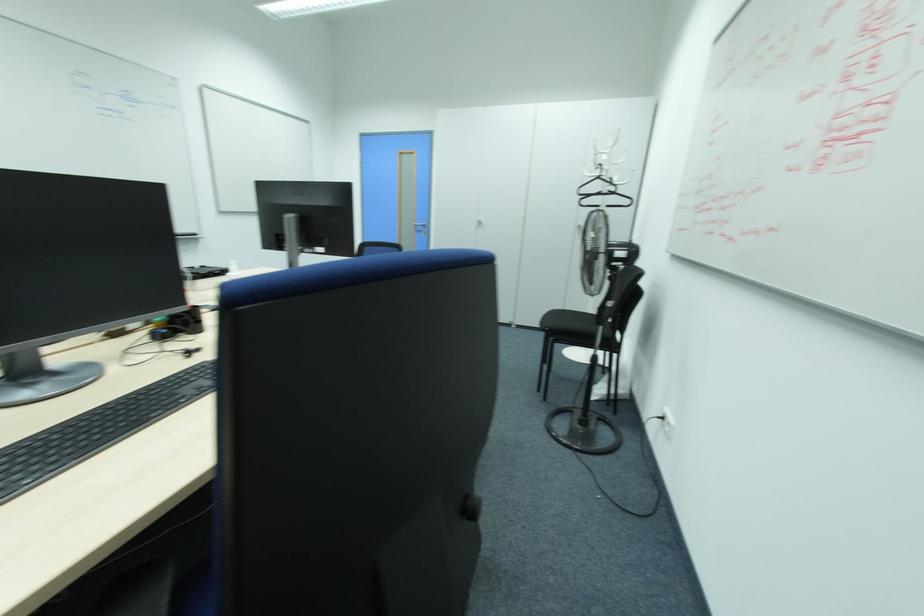
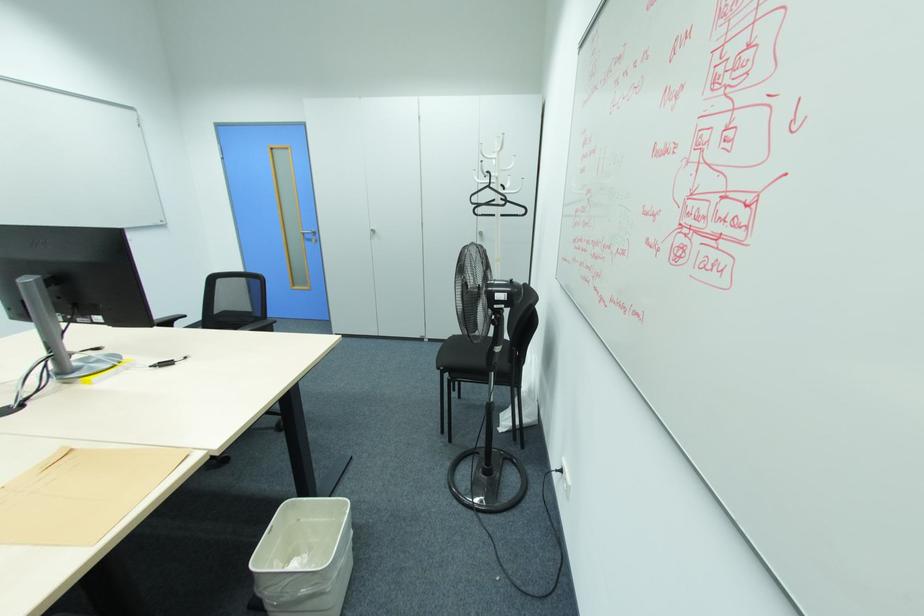
Where in the second image is the point corresponding to point 599,177 from the first image?

(490, 187)